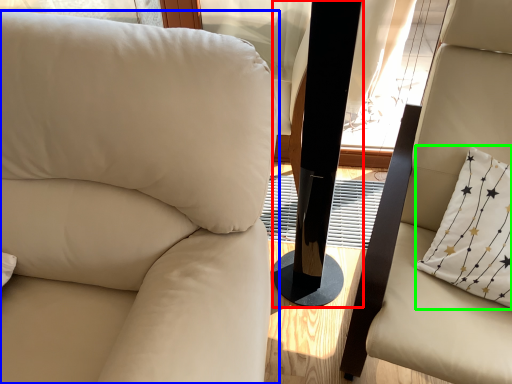
Question: Considering the real-world distances, which object is closest to pillar (highlighted by a red box)? chair (highlighted by a blue box) or pillow (highlighted by a green box).

Choices:
 (A) chair
 (B) pillow

Answer: (B)